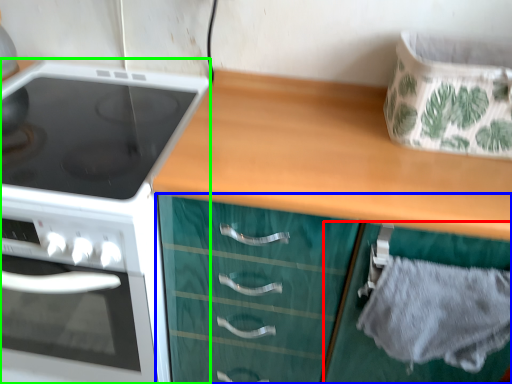
Question: Which is nearer to the cabinetry (highlighted by a red box)? cabinetry (highlighted by a blue box) or kitchen appliance (highlighted by a green box).

Choices:
 (A) cabinetry
 (B) kitchen appliance

Answer: (A)